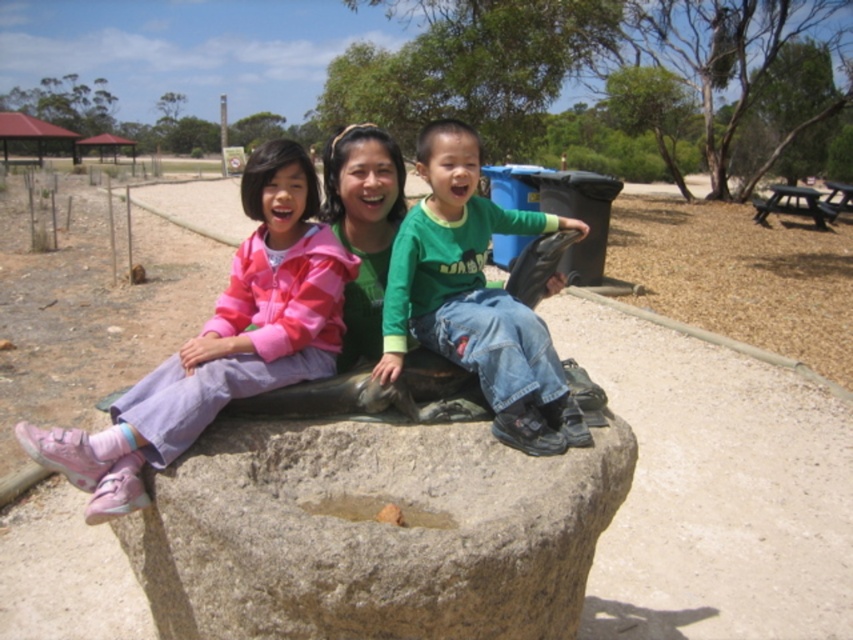
Question: Which of the following is the farthest from the observer?

Choices:
 (A) (80, 486)
 (B) (399, 369)
 (C) (347, 586)

Answer: (B)

Question: Does pink fleece jacket at left appear on the left side of green cotton shirt at center?

Choices:
 (A) yes
 (B) no

Answer: (A)

Question: Which is nearer to the green cotton shirt at center?

Choices:
 (A) smooth stone boulder at center
 (B) pink fleece jacket at left

Answer: (B)

Question: Does smooth stone boulder at center have a lesser width compared to pink fleece jacket at left?

Choices:
 (A) yes
 (B) no

Answer: (B)

Question: From the image, what is the correct spatial relationship of pink fleece jacket at left in relation to green cotton shirt at center?

Choices:
 (A) right
 (B) left

Answer: (B)

Question: Considering the real-world distances, which object is closest to the smooth stone boulder at center?

Choices:
 (A) green cotton shirt at center
 (B) pink fleece jacket at left

Answer: (A)